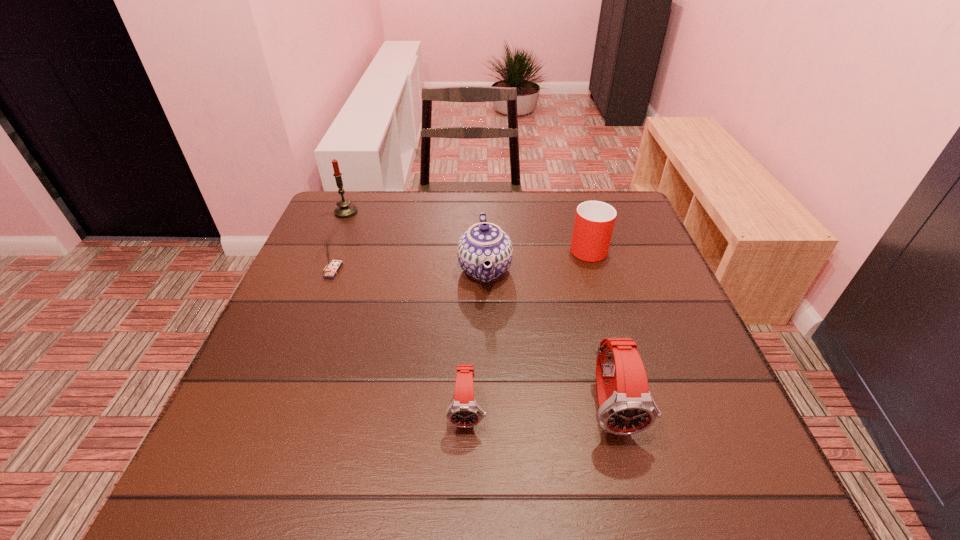
You are a GUI agent. You are given a task and a screenshot of the screen. Output one action in this format:
    pyautogui.click(x=<x>, y=<y>)
    Task: Click on the vacant position located 0.210m at the spout of the chinaware
    Image resolution: width=960 pixels, height=540 pixels.
    Given the screenshot: What is the action you would take?
    pyautogui.click(x=373, y=269)

The height and width of the screenshot is (540, 960). I want to click on blank space located 0.190m at the spout of the chinaware, so click(381, 269).

Locate an element on the screen. The width and height of the screenshot is (960, 540). free spot located at the spout of the chinaware is located at coordinates (297, 269).

Where is `vacant space situated on the left of the matchbox`? Image resolution: width=960 pixels, height=540 pixels. vacant space situated on the left of the matchbox is located at coordinates (300, 271).

Where is `cup located at the far edge`? This screenshot has width=960, height=540. cup located at the far edge is located at coordinates (594, 221).

The height and width of the screenshot is (540, 960). What are the coordinates of `candle present at the far edge` in the screenshot? It's located at pyautogui.click(x=345, y=209).

You are a GUI agent. You are given a task and a screenshot of the screen. Output one action in this format:
    pyautogui.click(x=<x>, y=<y>)
    Task: Click on the candle present at the left edge
    The width and height of the screenshot is (960, 540).
    Given the screenshot: What is the action you would take?
    pyautogui.click(x=345, y=209)

At what (x,y) coordinates should I click in order to perform the action: click on matchbox present at the left edge. Please return your answer as a coordinate pair (x, y). Looking at the image, I should click on (333, 267).

The width and height of the screenshot is (960, 540). I want to click on object that is at the right edge, so click(x=594, y=221).

This screenshot has width=960, height=540. What are the coordinates of `object present at the far left corner` in the screenshot? It's located at (345, 209).